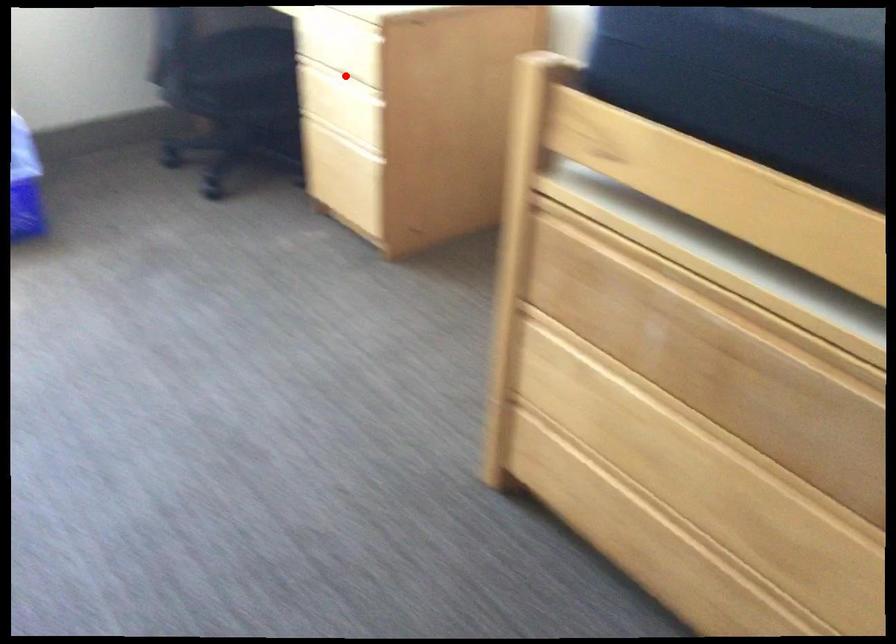
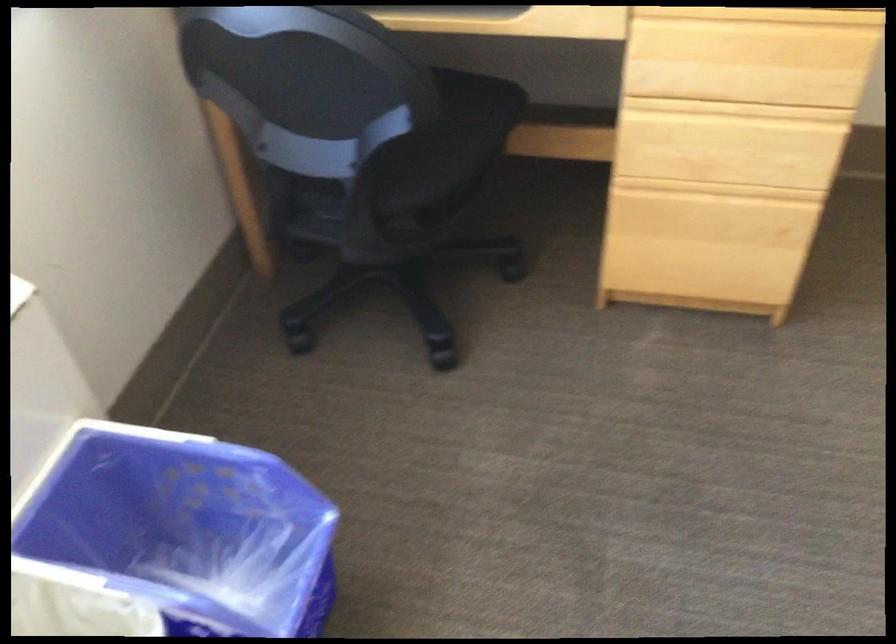
Question: I am providing you with two images of the same scene from different viewpoints. In image1, a red point is highlighted. Considering the same 3D point in image2, which of the following is correct?

Choices:
 (A) It is closer
 (B) It is farther

Answer: (A)